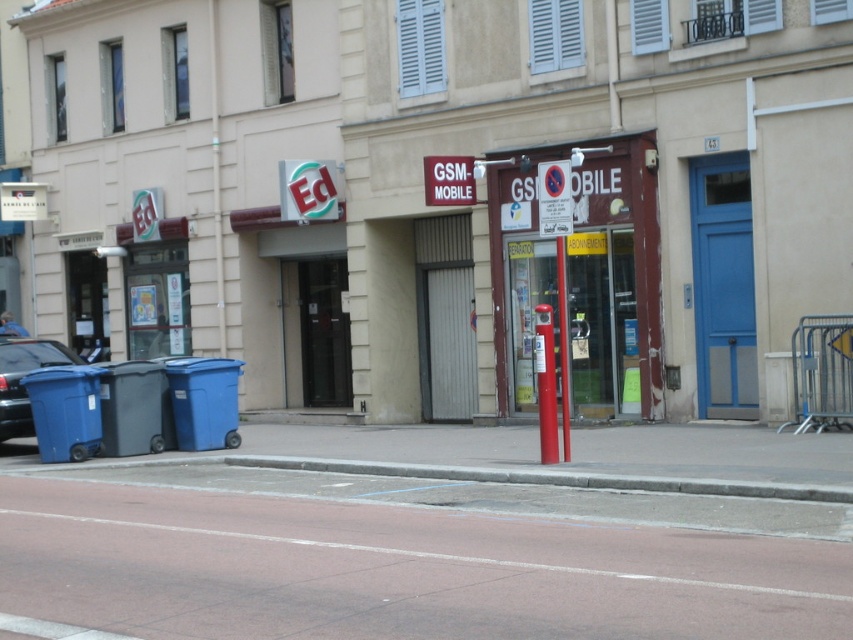
Based on the photo, you are standing at the point with coordinates point (x=561, y=426) and want to walk to the point with coordinates point (x=3, y=435). Which direction should you go?

You should walk forward because point (x=3, y=435) is behind point (x=561, y=426).

You are driving a car that is 15 feet long and want to park between the metallic blue car at left and the red plastic pole at center. Is there enough space for your car to fit between them?

The metallic blue car at left and the red plastic pole at center are 25.70 feet apart from each other. Since your car is 15 feet long, there is sufficient space to park between them as the distance between the two objects is greater than the car length.

You are standing on the sidewalk in front of the shops. You want to cross the street to reach a park located across. The road has a speed limit of 30 km per hour. Considering the distance between you and the concrete at lower center, do you think it is safe to cross the road here?

The distance between you and the concrete at lower center is 15.50 meters. Since the road has a speed limit of 30 km per hour, it would take a car approximately 9 seconds to travel this distance. This is a safe distance to cross the road as you have enough time to reach the other side before any oncoming traffic arrives.